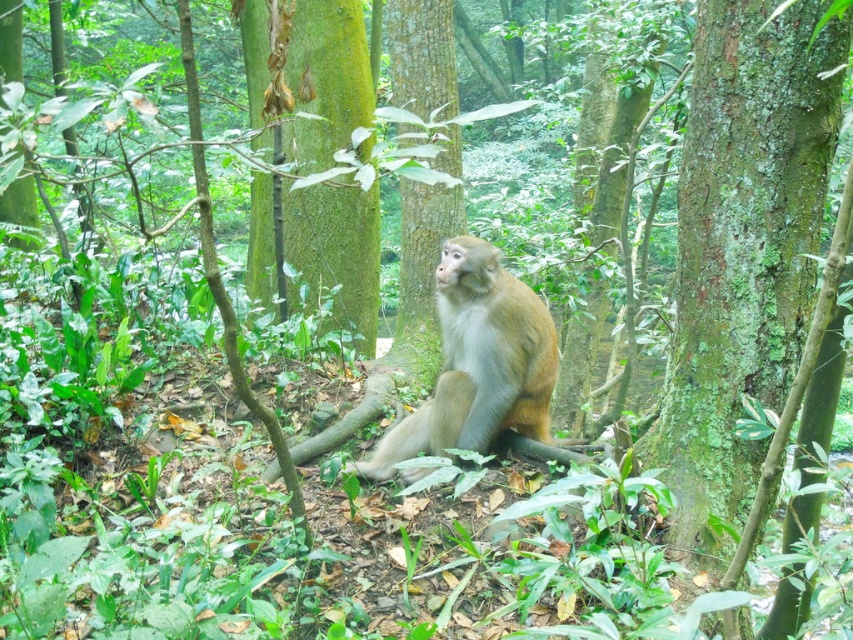
You are a hiker who wants to place a 5 feet long ladder between the green mossy tree trunk at center and the golden fur monkey at center. Can you fit the ladder between them?

The green mossy tree trunk at center is 7.52 feet from the golden fur monkey at center, so the ladder can fit between them since it is shorter than the distance between the two objects.

You are navigating through a forest and need to locate the green mossy bark tree at center. Based on the coordinates provided, where would you find it in relation to the monkey?

The green mossy bark tree at center is located at coordinates point [743,248], which places it slightly to the left and upwards from the monkey since the monkey is positioned centrally in the frame gazing upwards towards the left side of the image.